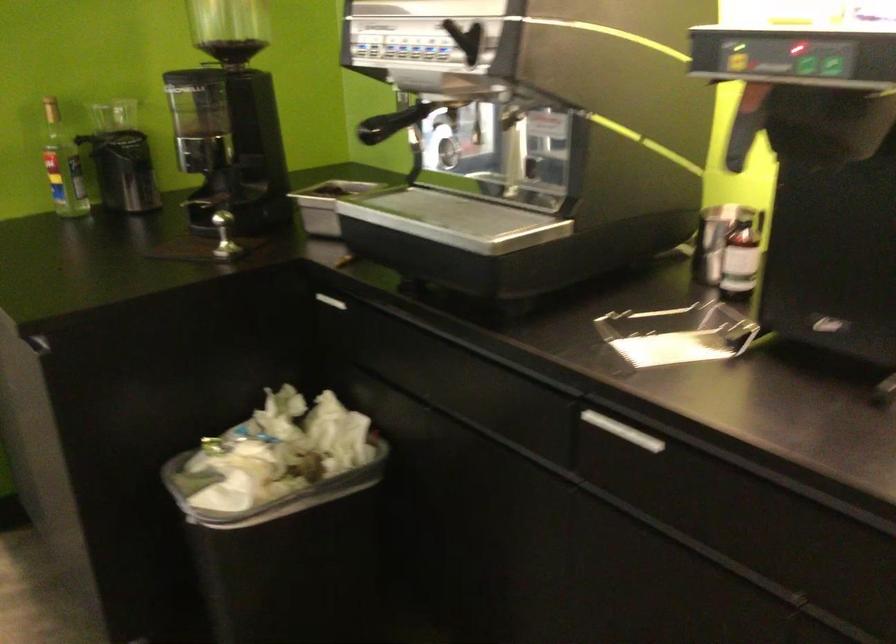
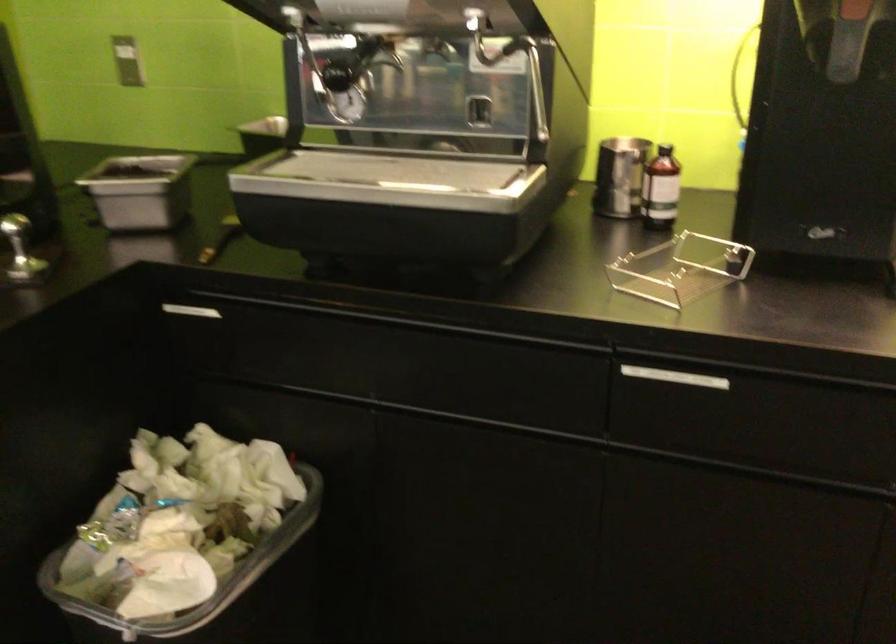
Where in the second image is the point corresponding to point 555,131 from the first image?

(513, 64)